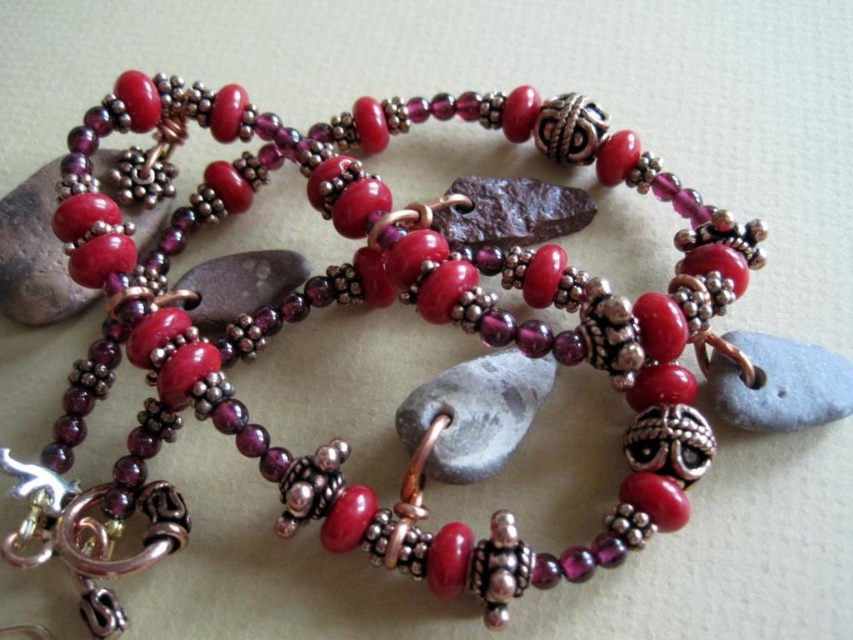
Who is positioned more to the left, matte silver stone at upper left or gray matte stone at center?

From the viewer's perspective, matte silver stone at upper left appears more on the left side.

What do you see at coordinates (35, 253) in the screenshot?
I see `matte silver stone at upper left` at bounding box center [35, 253].

Is point (102, 180) positioned in front of point (762, 429)?

No, (102, 180) is further to viewer.

Image resolution: width=853 pixels, height=640 pixels. In order to click on matte silver stone at upper left in this screenshot , I will do `click(35, 253)`.